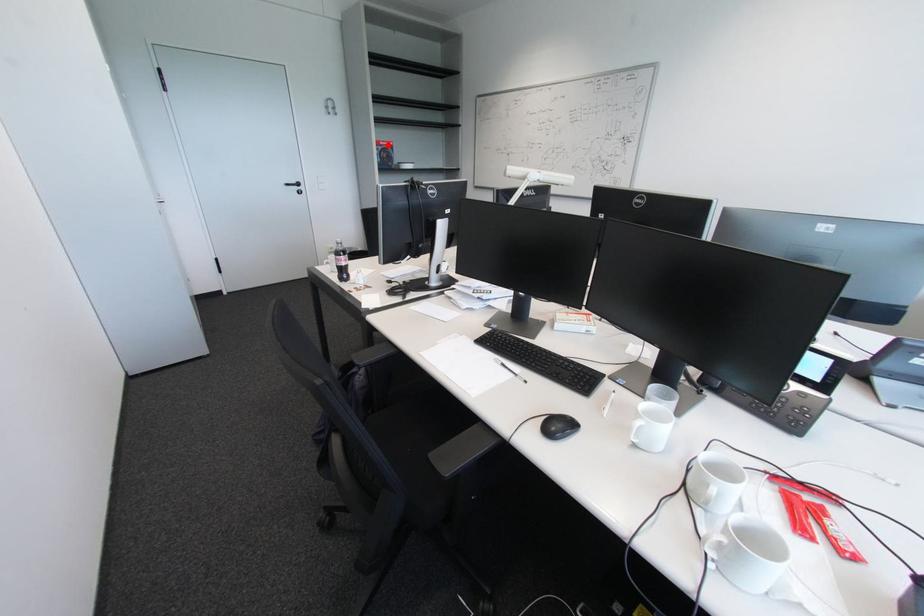
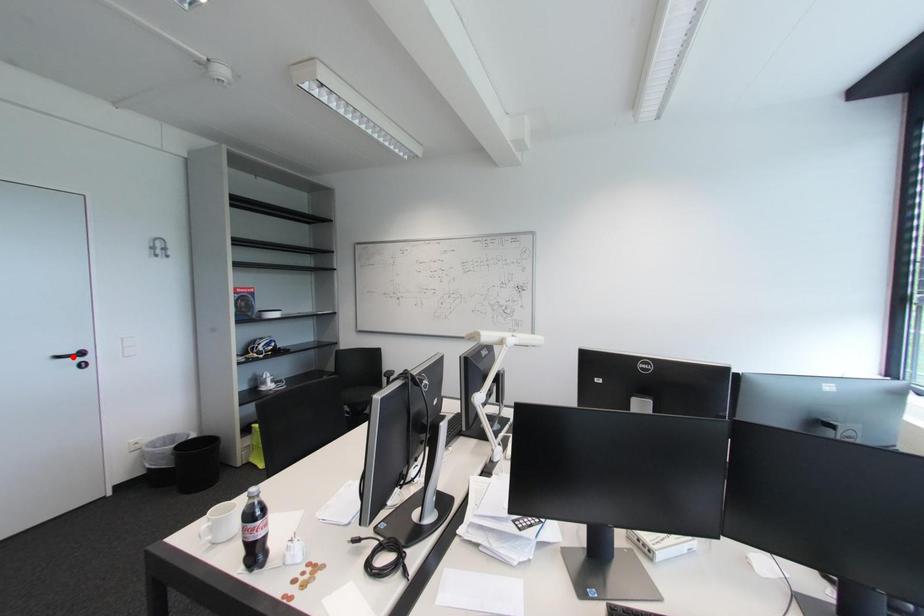
I am providing you with two images of the same scene from different viewpoints. A red point is marked on the first image and another point is marked on the second image. Is the red point in image1 aligned with the point shown in image2?

No